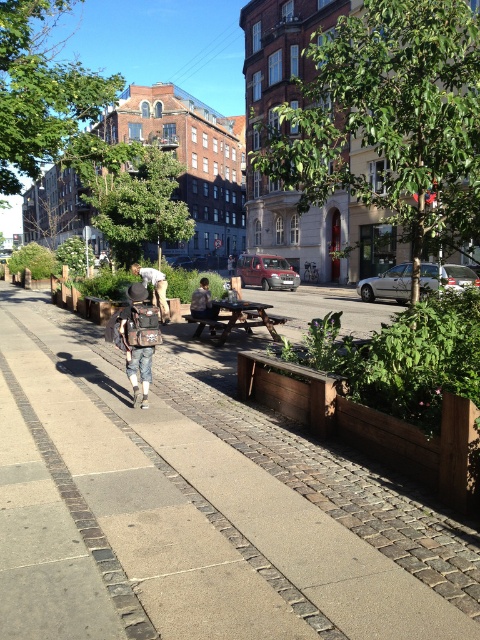
Does denim jacket at center appear on the right side of dark blue jeans at center?

In fact, denim jacket at center is to the left of dark blue jeans at center.

Which of these two, denim jacket at center or dark blue jeans at center, stands shorter?

dark blue jeans at center is shorter.

Between point (135, 392) and point (193, 336), which one is positioned behind?

Positioned behind is point (193, 336).

Identify the location of denim jacket at center. This screenshot has width=480, height=640. (139, 339).

Is brown wooden pavement at center in front of denim jacket at center?

Yes, it is.

Does point (173, 536) come farther from viewer compared to point (149, 336)?

No, (173, 536) is in front of (149, 336).

Is point (97, 584) farther from viewer compared to point (135, 288)?

That is False.

Find the location of a particular element. This screenshot has height=640, width=480. brown wooden pavement at center is located at coordinates coord(206,512).

Is light brown leather jacket at center below dark blue jeans at center?

No, light brown leather jacket at center is not below dark blue jeans at center.

This screenshot has height=640, width=480. What are the coordinates of `light brown leather jacket at center` in the screenshot? It's located at (155, 288).

Image resolution: width=480 pixels, height=640 pixels. Find the location of `light brown leather jacket at center`. light brown leather jacket at center is located at coordinates (155, 288).